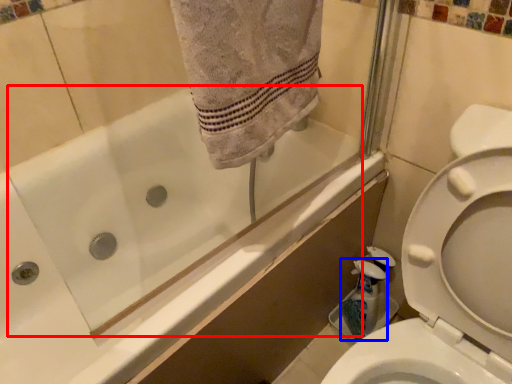
Question: Which object appears closest to the camera in this image, bath (highlighted by a red box) or cleaning product (highlighted by a blue box)?

Choices:
 (A) bath
 (B) cleaning product

Answer: (A)